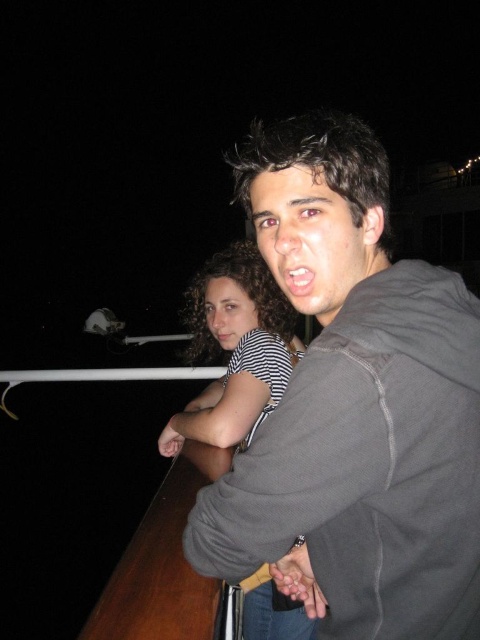
You are trying to locate the dark gray hoodie at center on a coordinate system where the bottom left corner is the origin. What are its coordinates?

The dark gray hoodie at center is located at coordinates approximately 0.636 on the x axis and 0.740 on the y axis.

You are a photographer trying to capture both the dark gray hoodie at center and the striped fabric shirt at upper center in a single frame. Considering their sizes, which one should you adjust your camera focus on to ensure both are in focus without moving your position?

Since the dark gray hoodie at center is thinner than the striped fabric shirt at upper center, you should focus on the striped fabric shirt at upper center because it is larger and will require more focus depth to capture clearly.

You are trying to locate the dark gray hoodie at center and the striped fabric shirt at upper center in the image. Based on their positions, which object is closer to the right edge of the image?

The dark gray hoodie at center is to the right of striped fabric shirt at upper center, so it is closer to the right edge of the image.